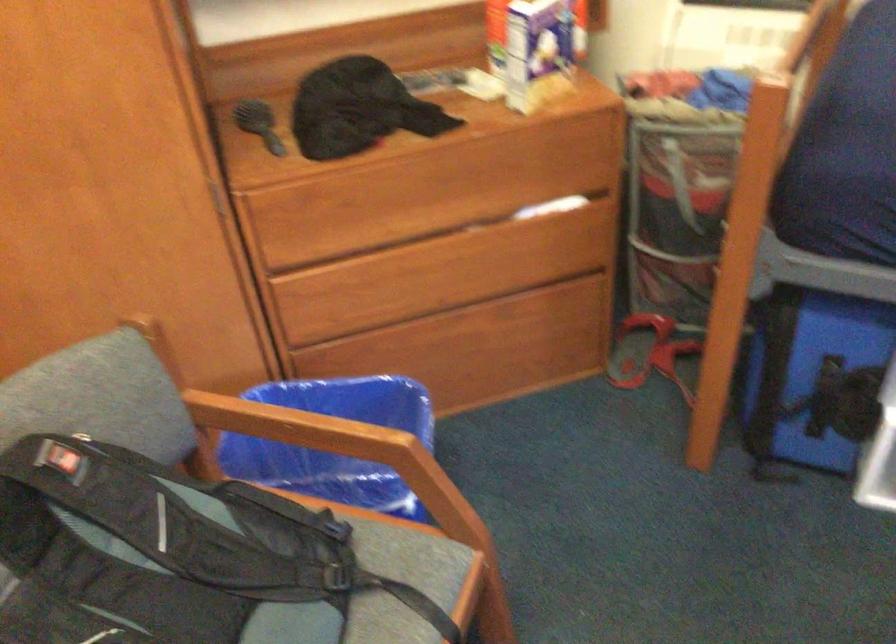
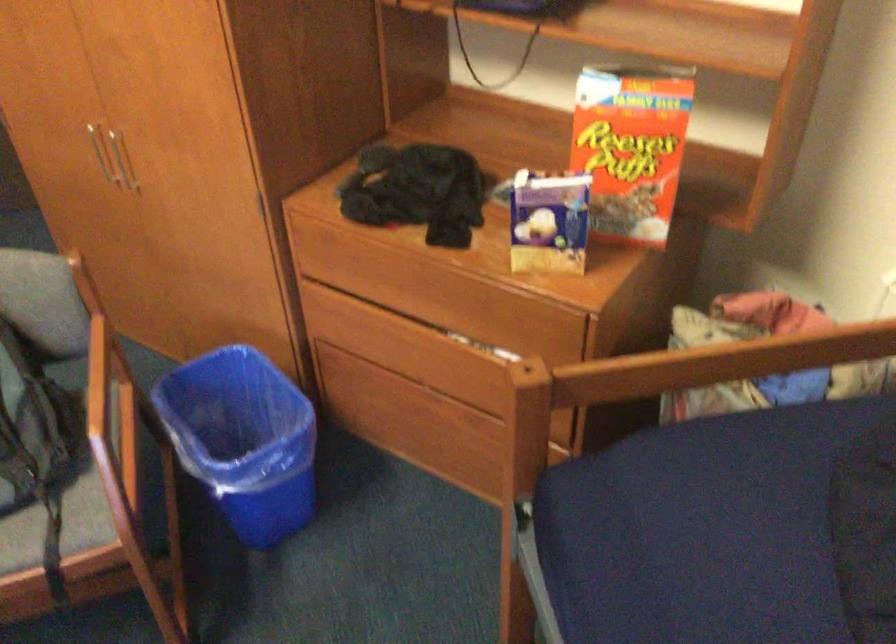
In the second image, find the point that corresponds to (426,363) in the first image.

(409, 419)